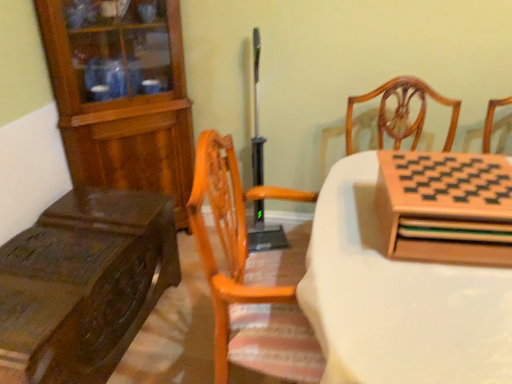
Question: Is wooden cabinet at left, marked as the second cabinetry in a right-to-left arrangement, thinner than wooden chessboard at upper right, which appears as the second table when viewed from the left?

Choices:
 (A) no
 (B) yes

Answer: (B)

Question: From the image's perspective, is wooden cabinet at left, which appears as the first cabinetry when viewed from the back, over wooden chessboard at upper right, which appears as the second table when viewed from the left?

Choices:
 (A) yes
 (B) no

Answer: (A)

Question: From a real-world perspective, is wooden cabinet at left, which appears as the first cabinetry when viewed from the back, positioned under wooden chessboard at upper right, which appears as the second table when viewed from the left, based on gravity?

Choices:
 (A) yes
 (B) no

Answer: (B)

Question: From a real-world perspective, is wooden cabinet at left, which appears as the first cabinetry when viewed from the back, over wooden chessboard at upper right, which appears as the 1th table when viewed from the right?

Choices:
 (A) no
 (B) yes

Answer: (B)

Question: Would you say wooden chessboard at upper right, which appears as the 1th table when viewed from the right, is part of wooden cabinet at left, placed as the 1th cabinetry when sorted from left to right,'s contents?

Choices:
 (A) no
 (B) yes

Answer: (A)

Question: Is wooden cabinet at left, placed as the 1th cabinetry when sorted from left to right, next to wooden chessboard at upper right, which appears as the 1th table when viewed from the right?

Choices:
 (A) no
 (B) yes

Answer: (A)

Question: Could you tell me if wooden chessboard at upper right, which appears as the 1th table when viewed from the right, is facing dark brown wood table at left, the second table when ordered from right to left?

Choices:
 (A) no
 (B) yes

Answer: (A)

Question: Does wooden chessboard at upper right, which appears as the second table when viewed from the left, have a lesser height compared to dark brown wood table at left, the second table when ordered from right to left?

Choices:
 (A) yes
 (B) no

Answer: (B)

Question: Is wooden chessboard at upper right, which appears as the second table when viewed from the left, oriented away from dark brown wood table at left, the first table positioned from the left?

Choices:
 (A) yes
 (B) no

Answer: (A)

Question: Is wooden chessboard at upper right, which appears as the second table when viewed from the left, to the left of dark brown wood table at left, the second table when ordered from right to left, from the viewer's perspective?

Choices:
 (A) yes
 (B) no

Answer: (B)

Question: Is wooden chessboard at upper right, which appears as the 1th table when viewed from the right, smaller than dark brown wood table at left, the second table when ordered from right to left?

Choices:
 (A) yes
 (B) no

Answer: (B)

Question: Can you confirm if wooden chessboard at upper right, which appears as the second table when viewed from the left, is wider than dark brown wood table at left, the second table when ordered from right to left?

Choices:
 (A) no
 (B) yes

Answer: (B)

Question: Is wooden chessboard at right, the second cabinetry when ordered from left to right, at the right side of wooden chessboard at upper right, which appears as the 1th table when viewed from the right?

Choices:
 (A) no
 (B) yes

Answer: (A)